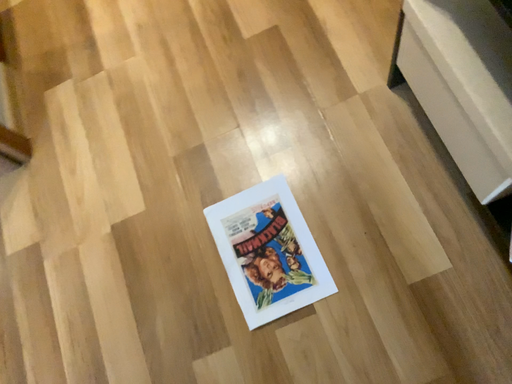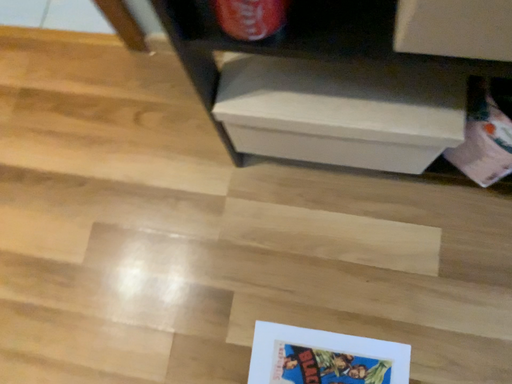
Question: Which way did the camera rotate in the video?

Choices:
 (A) rotated downward
 (B) rotated upward

Answer: (B)